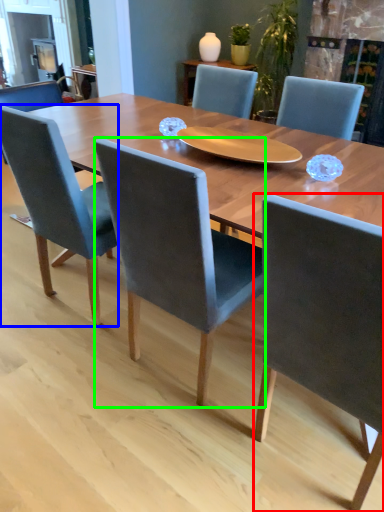
Question: Which object is the closest to the chair (highlighted by a red box)? Choose among these: chair (highlighted by a blue box) or chair (highlighted by a green box).

Choices:
 (A) chair
 (B) chair

Answer: (B)